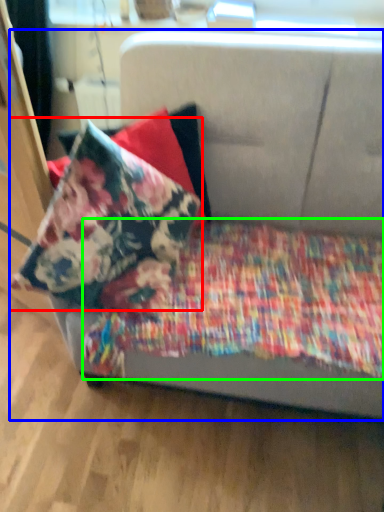
Question: Which object is the farthest from pillow (highlighted by a red box)? Choose among these: studio couch (highlighted by a blue box) or blanket (highlighted by a green box).

Choices:
 (A) studio couch
 (B) blanket

Answer: (A)